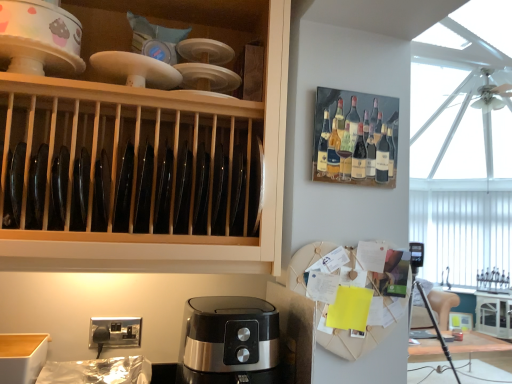
Question: From the image's perspective, is white glossy cabinet at right, positioned as the second cabinetry in left-to-right order, under wooden plate rack at upper right?

Choices:
 (A) yes
 (B) no

Answer: (A)

Question: Is white glossy cabinet at right, the first cabinetry in the bottom-to-top sequence, positioned far away from wooden plate rack at upper right?

Choices:
 (A) no
 (B) yes

Answer: (B)

Question: Is wooden plate rack at upper right surrounded by white glossy cabinet at right, positioned as the second cabinetry in left-to-right order?

Choices:
 (A) no
 (B) yes

Answer: (A)

Question: Can you confirm if white glossy cabinet at right, the first cabinetry in the bottom-to-top sequence, is shorter than wooden plate rack at upper right?

Choices:
 (A) yes
 (B) no

Answer: (B)

Question: Can you confirm if white glossy cabinet at right, the second cabinetry from the front, is thinner than wooden plate rack at upper right?

Choices:
 (A) no
 (B) yes

Answer: (A)

Question: Is wooden plate rack at upper right inside the boundaries of matte ceramic bowl at upper left, or outside?

Choices:
 (A) outside
 (B) inside

Answer: (A)

Question: Is point (346, 105) closer or farther from the camera than point (25, 41)?

Choices:
 (A) closer
 (B) farther

Answer: (B)

Question: Is wooden plate rack at upper right bigger or smaller than matte ceramic bowl at upper left?

Choices:
 (A) small
 (B) big

Answer: (A)

Question: Looking at their shapes, would you say wooden plate rack at upper right is wider or thinner than matte ceramic bowl at upper left?

Choices:
 (A) thin
 (B) wide

Answer: (A)

Question: Is wooden plate rack at upper right bigger or smaller than white glossy cabinet at right, positioned as the second cabinetry in left-to-right order?

Choices:
 (A) small
 (B) big

Answer: (A)

Question: Is wooden plate rack at upper right taller or shorter than white glossy cabinet at right, the first cabinetry in the bottom-to-top sequence?

Choices:
 (A) tall
 (B) short

Answer: (B)

Question: Considering their positions, is wooden plate rack at upper right located in front of or behind white glossy cabinet at right, acting as the second cabinetry starting from the top?

Choices:
 (A) front
 (B) behind

Answer: (A)

Question: Considering the positions of wooden plate rack at upper right and white glossy cabinet at right, the second cabinetry from the front, in the image, is wooden plate rack at upper right wider or thinner than white glossy cabinet at right, the second cabinetry from the front,?

Choices:
 (A) thin
 (B) wide

Answer: (A)

Question: From a real-world perspective, is satin black coffee maker at lower center above or below matte ceramic bowl at upper left?

Choices:
 (A) above
 (B) below

Answer: (B)

Question: Does point tap(202, 337) appear closer or farther from the camera than point tap(31, 39)?

Choices:
 (A) closer
 (B) farther

Answer: (B)